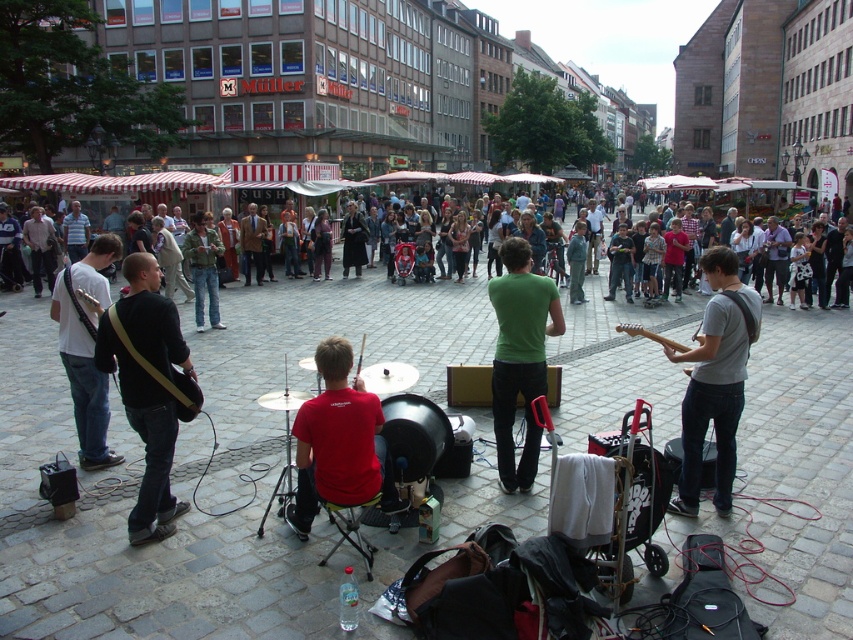
You are a photographer standing in the square and want to take a photo that includes both the green matte shirt at center and the matte black guitar at left. Based on their positions, which one would appear closer to the camera in the photo?

The green matte shirt at center appears closer to the camera in the photo because it is positioned in front of the matte black guitar at left.

You are a photographer standing in front of the black leather guitar at left and the green matte shirt at center. You want to take a photo that captures both objects clearly. Which object should you focus on first to ensure both are in sharp focus?

The black leather guitar at left is closer to the viewer than the green matte shirt at center. To ensure both are in sharp focus, you should focus on the black leather guitar at left first, as it is the closer object. This will create a depth of field that includes the green matte shirt at center in the background.

You are a street performer who just finished your set. You need to pack your gear. Which item, the matte black guitar at left or the multicolored casual clothing at center, should you pick up first if you want to start with the smaller one?

The matte black guitar at left is smaller than the multicolored casual clothing at center, so you should pick up the matte black guitar at left first.